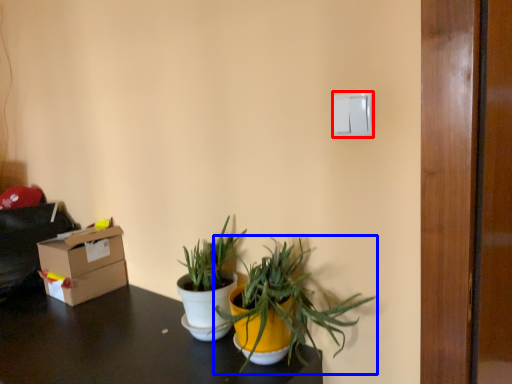
Question: Among these objects, which one is farthest to the camera, light switch (highlighted by a red box) or houseplant (highlighted by a blue box)?

Choices:
 (A) light switch
 (B) houseplant

Answer: (A)